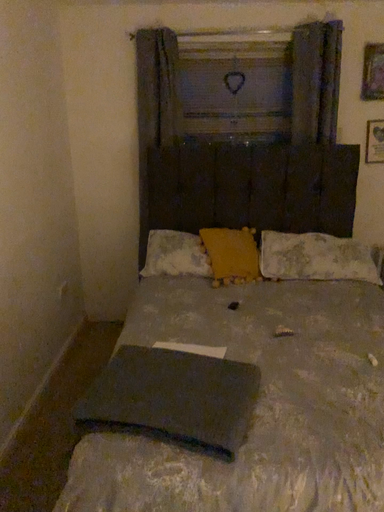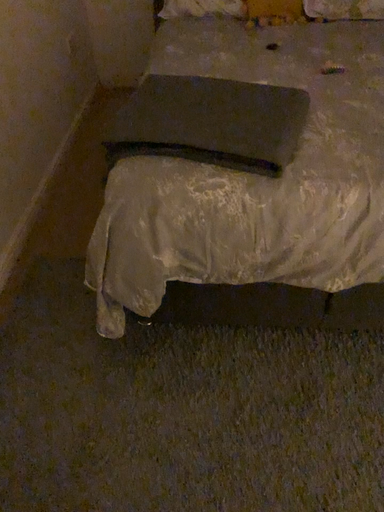
Question: Which way did the camera rotate in the video?

Choices:
 (A) rotated downward
 (B) rotated upward

Answer: (A)